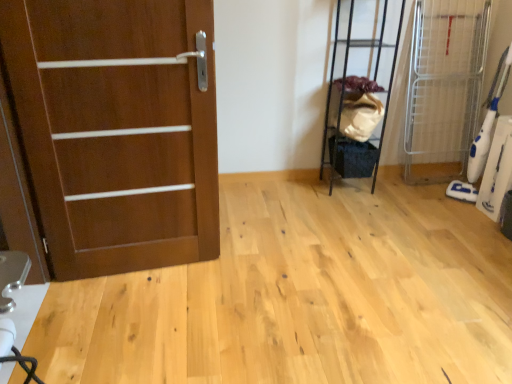
I want to click on vacant space to the right of matte wood door at left, so click(237, 281).